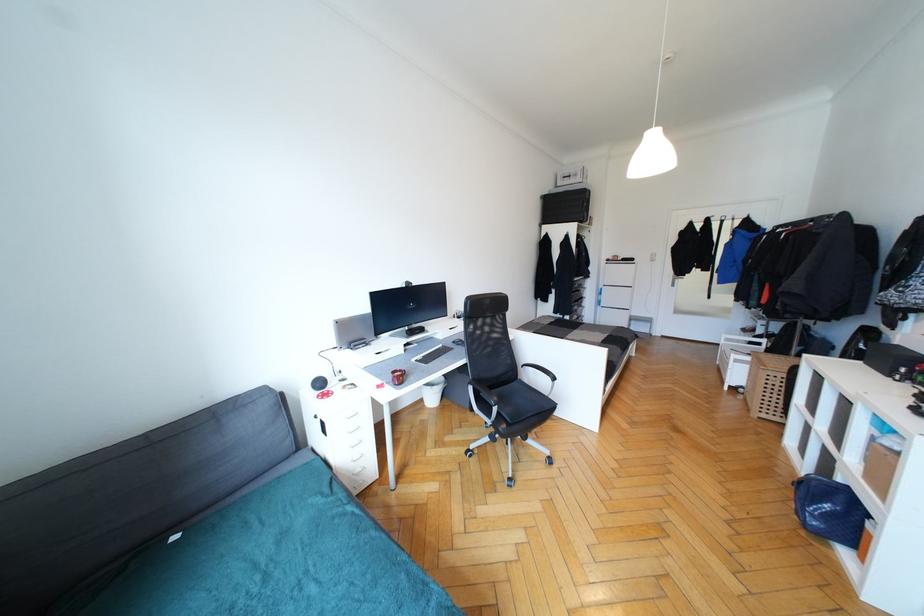
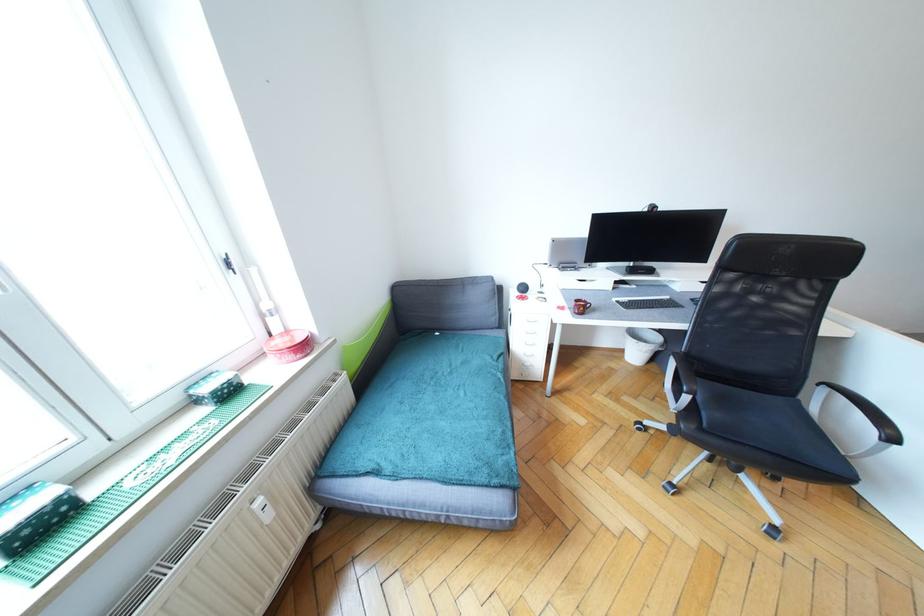
Where in the second image is the point corresponding to point 345,496 from the first image?

(504, 367)